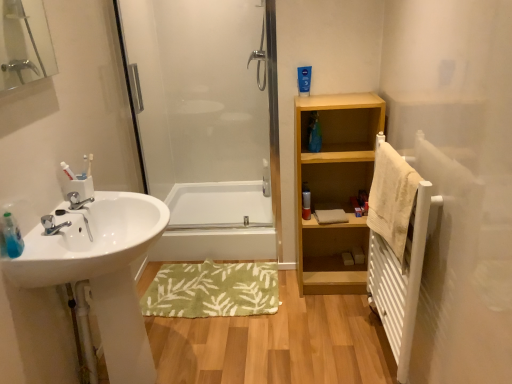
Question: Does point (74, 193) appear closer or farther from the camera than point (398, 254)?

Choices:
 (A) closer
 (B) farther

Answer: (B)

Question: Relative to beige textured towel at right, is silver metallic faucet at sink left in front or behind?

Choices:
 (A) front
 (B) behind

Answer: (B)

Question: Estimate the real-world distances between objects in this image. Which object is farther from the white glossy bathtub at center?

Choices:
 (A) white glossy sink at left
 (B) matte silver canister at center
 (C) silver metallic faucet at sink left
 (D) light wood shelf at center right
 (E) white metallic radiator at right

Answer: (C)

Question: Considering the real-world distances, which object is farthest from the white glossy bathtub at center?

Choices:
 (A) silver metallic faucet at sink left
 (B) white metallic radiator at right
 (C) beige textured towel at right
 (D) matte silver canister at center
 (E) white glossy sink at left

Answer: (C)